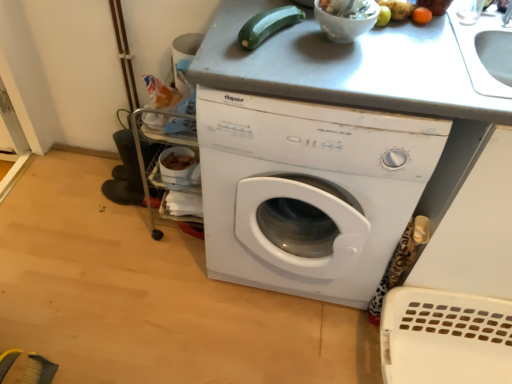
Question: From a real-world perspective, does orange matte fruit at upper right, the 1th vegetable when ordered from right to left, stand above white plastic washing machine at center?

Choices:
 (A) yes
 (B) no

Answer: (A)

Question: From a real-world perspective, is orange matte fruit at upper right, the 1th vegetable when ordered from right to left, beneath white plastic washing machine at center?

Choices:
 (A) yes
 (B) no

Answer: (B)

Question: Can you confirm if orange matte fruit at upper right, the second vegetable from the left, is smaller than white plastic washing machine at center?

Choices:
 (A) no
 (B) yes

Answer: (B)

Question: Is the depth of orange matte fruit at upper right, the second vegetable from the left, less than that of white plastic washing machine at center?

Choices:
 (A) no
 (B) yes

Answer: (A)

Question: Is orange matte fruit at upper right, the second vegetable from the left, turned away from white plastic washing machine at center?

Choices:
 (A) no
 (B) yes

Answer: (A)

Question: In terms of width, does green matte zucchini at upper center, the 2th vegetable from the right, look wider or thinner when compared to white plastic washing machine at center?

Choices:
 (A) wide
 (B) thin

Answer: (B)

Question: Is point (254, 16) positioned closer to the camera than point (231, 163)?

Choices:
 (A) closer
 (B) farther

Answer: (B)

Question: Would you say green matte zucchini at upper center, which ranks as the 1th vegetable in left-to-right order, is to the left or to the right of white plastic washing machine at center in the picture?

Choices:
 (A) right
 (B) left

Answer: (B)

Question: In terms of height, does green matte zucchini at upper center, the 2th vegetable from the right, look taller or shorter compared to white plastic washing machine at center?

Choices:
 (A) short
 (B) tall

Answer: (A)

Question: In terms of size, does white glossy bowl at upper center appear bigger or smaller than white plastic washing machine at center?

Choices:
 (A) small
 (B) big

Answer: (A)

Question: Considering the positions of white glossy bowl at upper center and white plastic washing machine at center in the image, is white glossy bowl at upper center taller or shorter than white plastic washing machine at center?

Choices:
 (A) short
 (B) tall

Answer: (A)

Question: From the image's perspective, is white glossy bowl at upper center above or below white plastic washing machine at center?

Choices:
 (A) below
 (B) above

Answer: (B)

Question: Is white glossy bowl at upper center wider or thinner than white plastic washing machine at center?

Choices:
 (A) thin
 (B) wide

Answer: (A)

Question: Is orange matte fruit at upper right, the second vegetable from the left, in front of or behind green matte zucchini at upper center, the 2th vegetable from the right, in the image?

Choices:
 (A) behind
 (B) front

Answer: (A)

Question: In terms of width, does orange matte fruit at upper right, the 1th vegetable when ordered from right to left, look wider or thinner when compared to green matte zucchini at upper center, which ranks as the 1th vegetable in left-to-right order?

Choices:
 (A) wide
 (B) thin

Answer: (B)